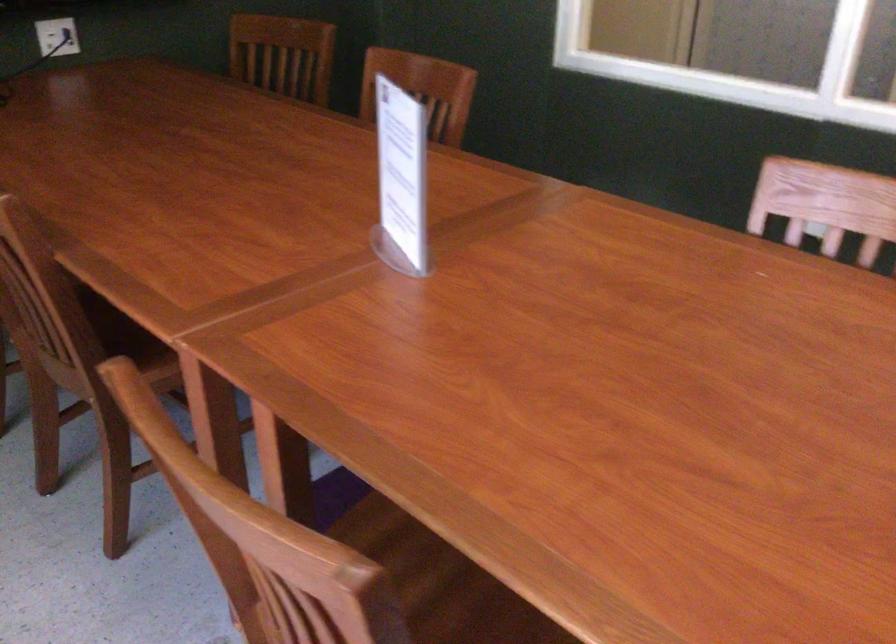
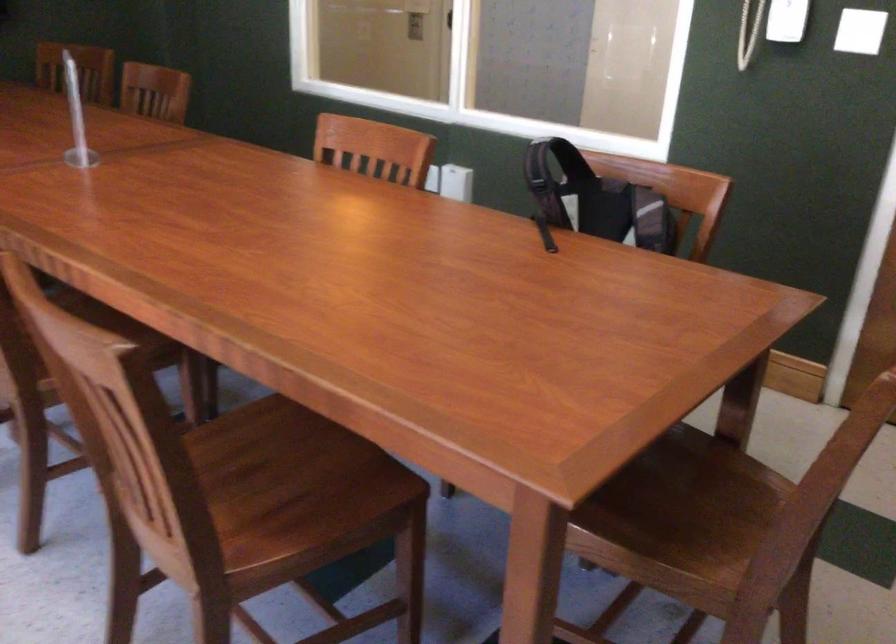
Which direction would the cameraman need to move to produce the second image?

The cameraman walked toward right, backward.